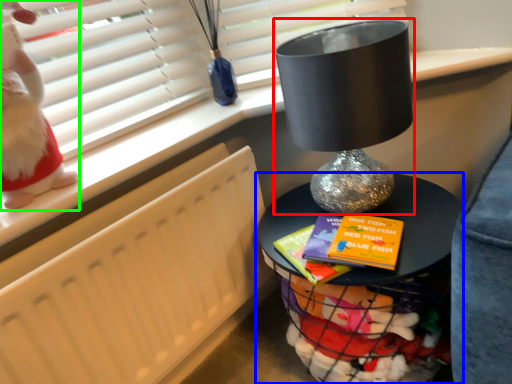
Question: Considering the real-world distances, which object is closest to table lamp (highlighted by a red box)? furniture (highlighted by a blue box) or doll (highlighted by a green box).

Choices:
 (A) furniture
 (B) doll

Answer: (A)